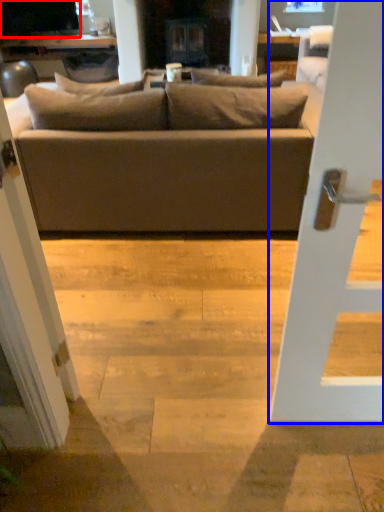
Question: Which point is closer to the camera, dark (highlighted by a red box) or door (highlighted by a blue box)?

Choices:
 (A) dark
 (B) door

Answer: (B)